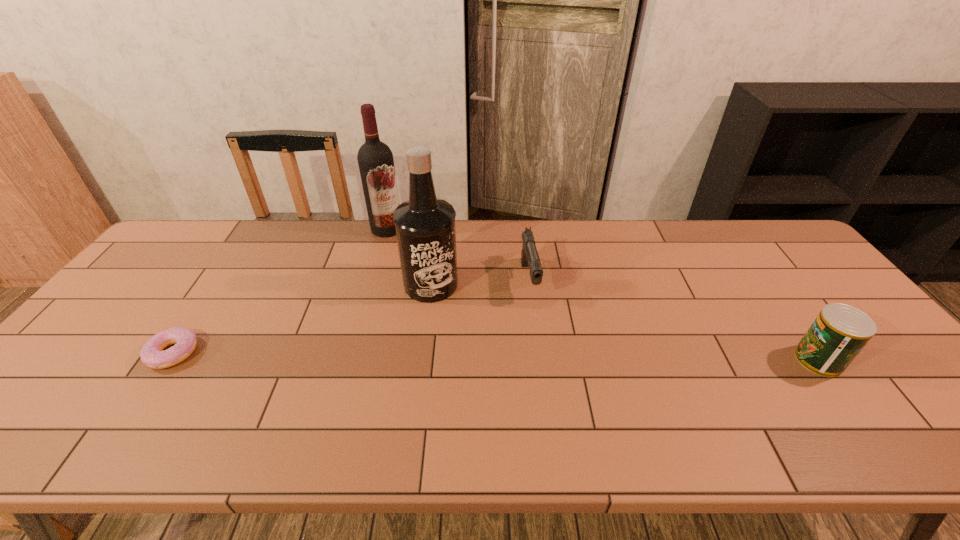
The width and height of the screenshot is (960, 540). I want to click on vacant space that's between the rightmost object and the second object from left to right, so click(x=603, y=294).

Where is `free space between the shortest object and the third object from right to left`? The height and width of the screenshot is (540, 960). free space between the shortest object and the third object from right to left is located at coordinates (302, 319).

Identify the location of free space between the fourth object from left to right and the rightmost object. Image resolution: width=960 pixels, height=540 pixels. (674, 320).

Identify which object is the third nearest to the liquor. Please provide its 2D coordinates. Your answer should be formatted as a tuple, i.e. [(x, y)], where the tuple contains the x and y coordinates of a point satisfying the conditions above.

[(152, 354)]

What are the coordinates of `object that can be found as the second closest to the third object from left to right` in the screenshot? It's located at (529, 256).

The image size is (960, 540). I want to click on free location that satisfies the following two spatial constraints: 1. on the front side of the second object from left to right; 2. on the left side of the fourth object from left to right, so click(372, 280).